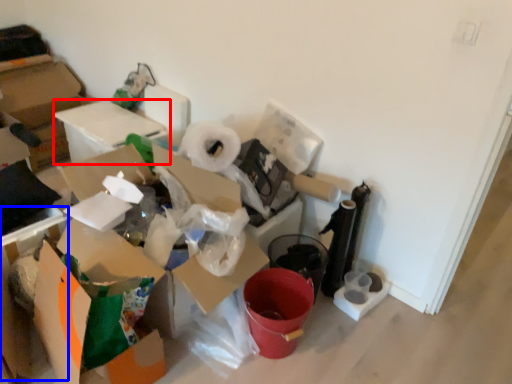
Question: Which of the following is the closest to the observer, cardboard box (highlighted by a red box) or cardboard box (highlighted by a blue box)?

Choices:
 (A) cardboard box
 (B) cardboard box

Answer: (B)